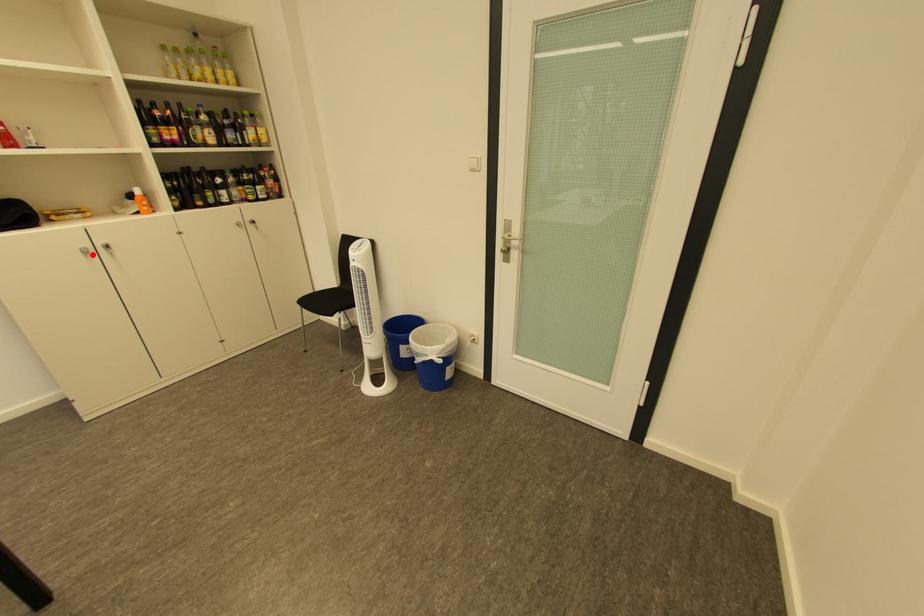
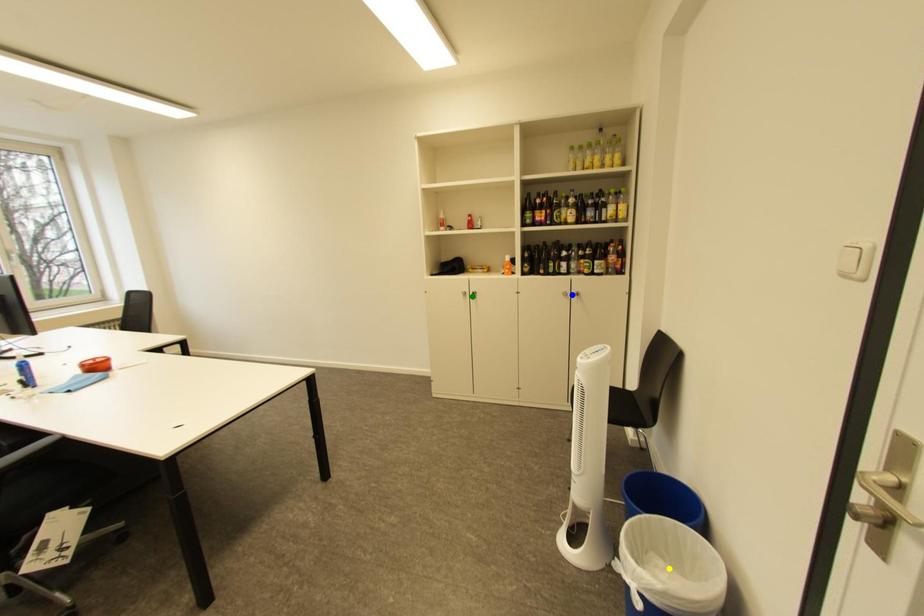
Question: I am providing you with two images of the same scene from different viewpoints. A red point is marked on the first image. You are given multiple points on the second image. Which spot in image 2 lines up with the point in image 1?

Choices:
 (A) blue point
 (B) green point
 (C) yellow point

Answer: (B)